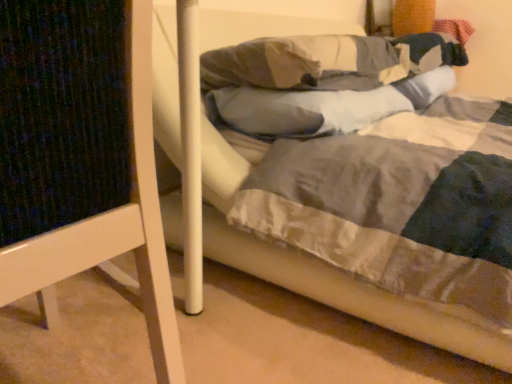
Question: Is gray soft pillow at center, which is the 1th pillow from bottom to top, not near white wood bed frame at left?

Choices:
 (A) no
 (B) yes

Answer: (A)

Question: Is gray soft pillow at center, the second pillow from the top, looking in the opposite direction of white wood bed frame at left?

Choices:
 (A) yes
 (B) no

Answer: (B)

Question: Is gray soft pillow at center, the second pillow from the top, positioned in front of white wood bed frame at left?

Choices:
 (A) no
 (B) yes

Answer: (A)

Question: From the image's perspective, would you say gray soft pillow at center, the second pillow from the top, is shown under white wood bed frame at left?

Choices:
 (A) yes
 (B) no

Answer: (B)

Question: Is gray soft pillow at center, which is the 1th pillow from bottom to top, located outside white wood bed frame at left?

Choices:
 (A) yes
 (B) no

Answer: (A)

Question: Looking at their shapes, would you say white wood bed frame at left is wider or thinner than gray soft pillow at center, the second pillow from the top?

Choices:
 (A) wide
 (B) thin

Answer: (A)

Question: Is white wood bed frame at left to the left or to the right of gray soft pillow at center, the second pillow from the top, in the image?

Choices:
 (A) right
 (B) left

Answer: (B)

Question: From their relative heights in the image, would you say white wood bed frame at left is taller or shorter than gray soft pillow at center, the second pillow from the top?

Choices:
 (A) short
 (B) tall

Answer: (B)

Question: Is point (5, 41) closer or farther from the camera than point (280, 114)?

Choices:
 (A) farther
 (B) closer

Answer: (B)

Question: Relative to white wood bed frame at left, is gray soft pillow at center, which is the 1th pillow from bottom to top, in front or behind?

Choices:
 (A) front
 (B) behind

Answer: (B)

Question: Is gray soft pillow at center, the second pillow from the top, wider or thinner than white wood bed frame at left?

Choices:
 (A) wide
 (B) thin

Answer: (B)

Question: Is point (296, 119) positioned closer to the camera than point (52, 81)?

Choices:
 (A) farther
 (B) closer

Answer: (A)

Question: From the image's perspective, is gray soft pillow at center, the second pillow from the top, positioned above or below white wood bed frame at left?

Choices:
 (A) above
 (B) below

Answer: (A)

Question: In terms of height, does gray soft pillow at center, the second pillow from the top, look taller or shorter compared to white soft pillow at center, the 1th pillow viewed from the top?

Choices:
 (A) tall
 (B) short

Answer: (B)

Question: Based on their sizes in the image, would you say gray soft pillow at center, which is the 1th pillow from bottom to top, is bigger or smaller than white soft pillow at center, arranged as the 2th pillow when ordered from the bottom?

Choices:
 (A) small
 (B) big

Answer: (A)